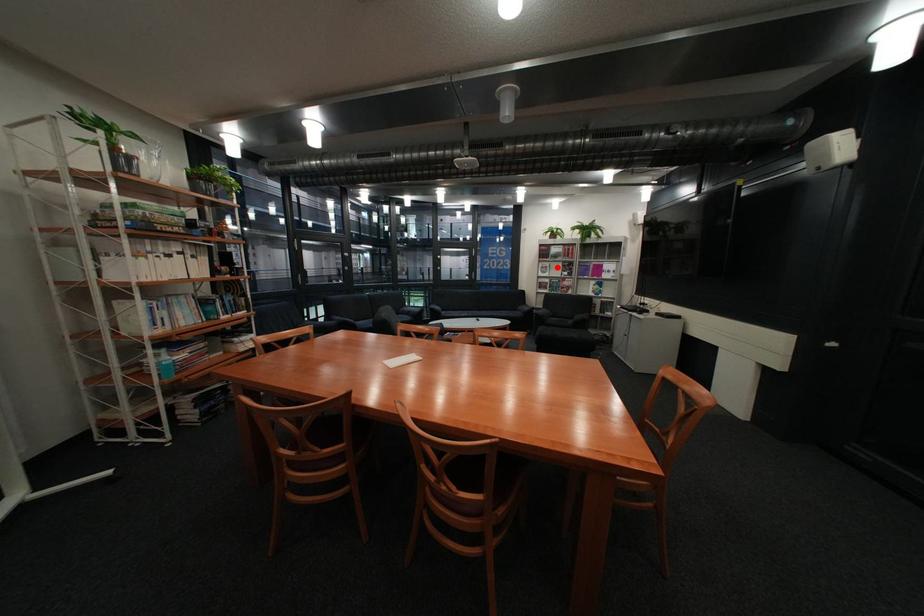
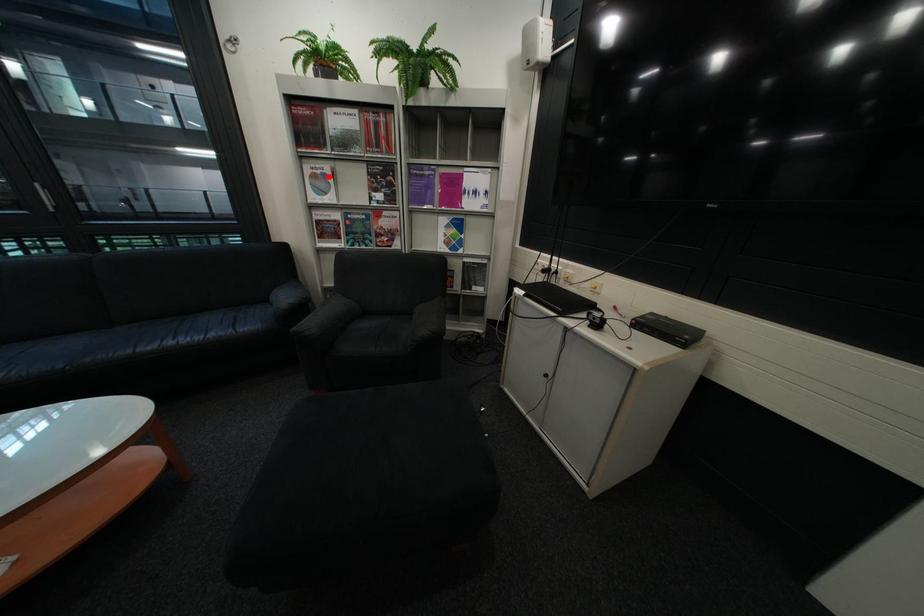
I am providing you with two images of the same scene from different viewpoints. A red point is marked on the first image and another point is marked on the second image. Does the point marked in image1 correspond to the same location as the one in image2?

Yes